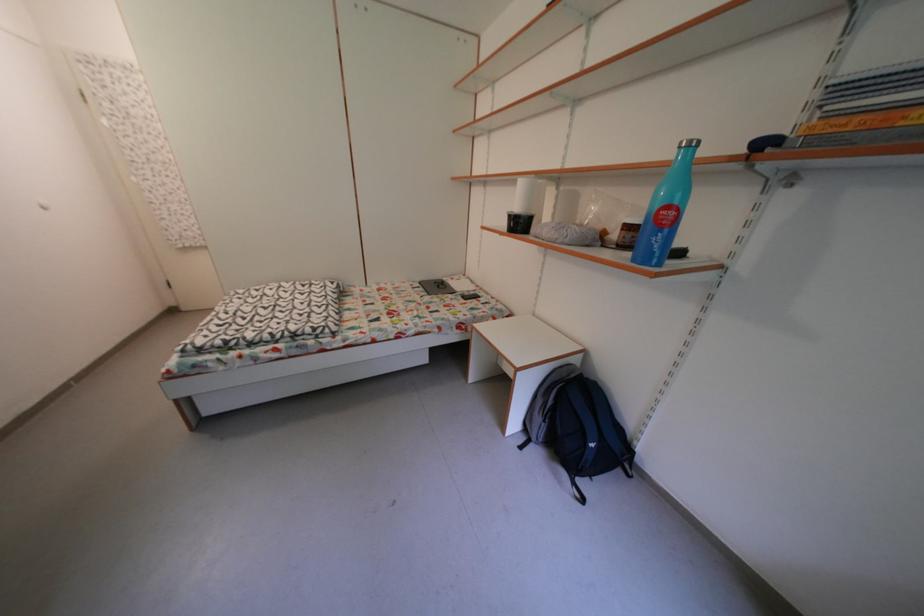
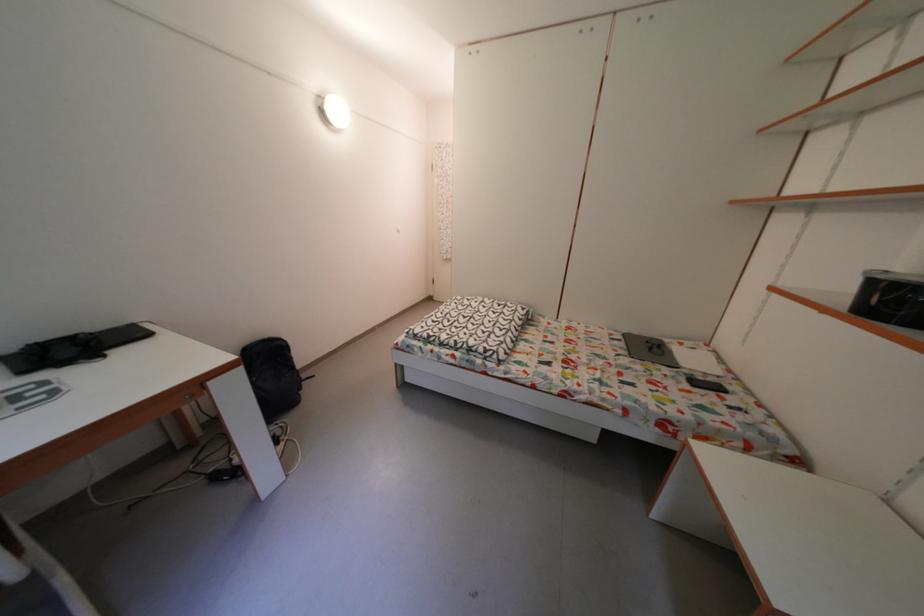
Question: How did the camera likely rotate?

Choices:
 (A) Left
 (B) Right
 (C) Up
 (D) Down

Answer: (A)